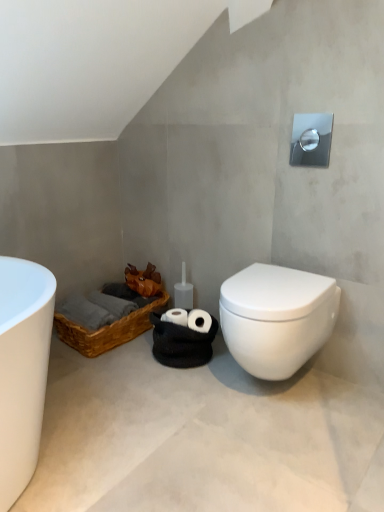
Question: Can we say white matte concrete at lower center lies outside white glossy toilet at lower right?

Choices:
 (A) yes
 (B) no

Answer: (A)

Question: Can you confirm if white matte concrete at lower center is shorter than white glossy toilet at lower right?

Choices:
 (A) yes
 (B) no

Answer: (A)

Question: Is white matte concrete at lower center taller than white glossy toilet at lower right?

Choices:
 (A) no
 (B) yes

Answer: (A)

Question: Considering the relative positions of white matte concrete at lower center and white glossy toilet at lower right in the image provided, is white matte concrete at lower center behind white glossy toilet at lower right?

Choices:
 (A) no
 (B) yes

Answer: (A)

Question: Does white matte concrete at lower center have a greater width compared to white glossy toilet at lower right?

Choices:
 (A) no
 (B) yes

Answer: (B)

Question: Based on their sizes in the image, would you say brown woven basket at lower left is bigger or smaller than white glossy toilet at lower right?

Choices:
 (A) small
 (B) big

Answer: (A)

Question: Is brown woven basket at lower left taller or shorter than white glossy toilet at lower right?

Choices:
 (A) short
 (B) tall

Answer: (A)

Question: From the image's perspective, is brown woven basket at lower left positioned above or below white glossy toilet at lower right?

Choices:
 (A) above
 (B) below

Answer: (B)

Question: In the image, is brown woven basket at lower left positioned in front of or behind white glossy toilet at lower right?

Choices:
 (A) front
 (B) behind

Answer: (B)

Question: Considering the positions of point (375, 490) and point (66, 339), is point (375, 490) closer or farther from the camera than point (66, 339)?

Choices:
 (A) closer
 (B) farther

Answer: (A)

Question: Is white matte concrete at lower center situated inside brown woven basket at lower left or outside?

Choices:
 (A) outside
 (B) inside

Answer: (A)

Question: Relative to brown woven basket at lower left, is white matte concrete at lower center in front or behind?

Choices:
 (A) front
 (B) behind

Answer: (A)

Question: Considering the positions of white matte concrete at lower center and brown woven basket at lower left in the image, is white matte concrete at lower center taller or shorter than brown woven basket at lower left?

Choices:
 (A) short
 (B) tall

Answer: (A)

Question: Is white glossy toilet at lower right to the left or to the right of white matte concrete at lower center in the image?

Choices:
 (A) left
 (B) right

Answer: (B)

Question: From their relative heights in the image, would you say white glossy toilet at lower right is taller or shorter than white matte concrete at lower center?

Choices:
 (A) tall
 (B) short

Answer: (A)